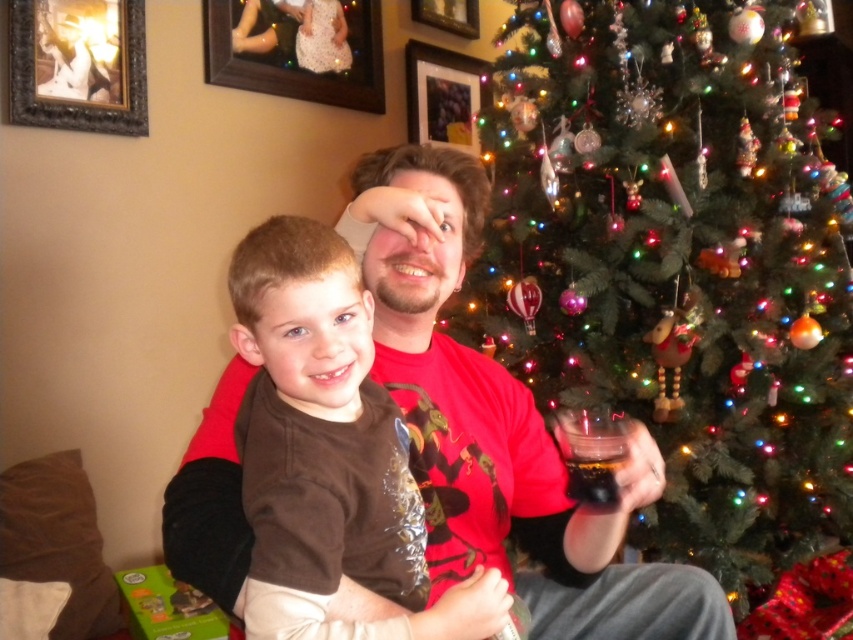
What object is located at the coordinates point (677, 264)?

The point (677, 264) marks the green matte christmas tree at right.

Consider the image. You are a photographer trying to capture the metallic silver frame at upper center and the dark glossy cup at right in the same photo. Which object should you focus on first to ensure both are in the frame?

You should focus on the metallic silver frame at upper center first because the dark glossy cup at right is behind it, so adjusting the frame to include the front object ensures the one behind is also captured.